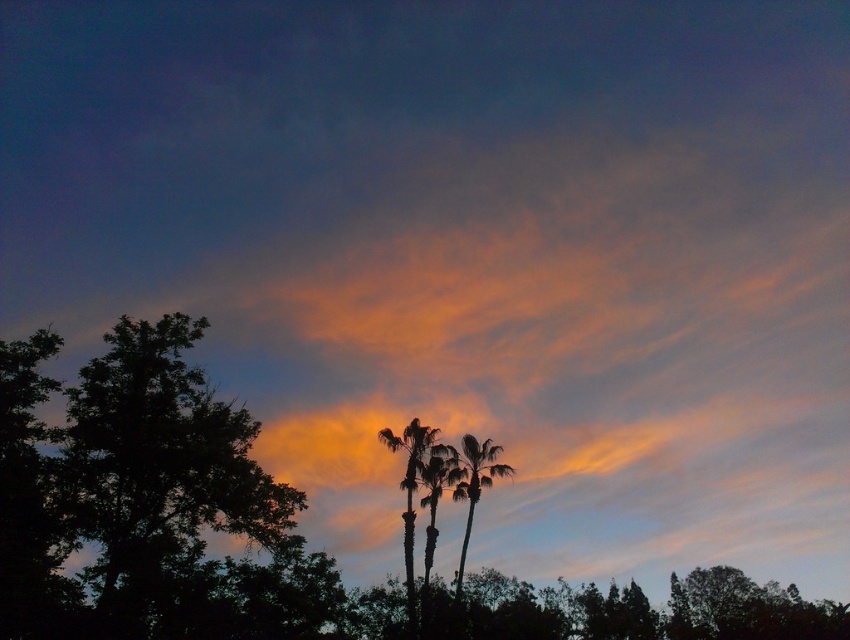
Question: Which point is farther from the camera taking this photo?

Choices:
 (A) (157, 557)
 (B) (422, 468)
 (C) (480, 472)

Answer: (C)

Question: Is silhouette palm trees at center below green leafy palm tree at center?

Choices:
 (A) yes
 (B) no

Answer: (B)

Question: Estimate the real-world distances between objects in this image. Which object is farther from the dark green leafy tree at left?

Choices:
 (A) silhouette palm trees at center
 (B) green leafy palm tree at center

Answer: (B)

Question: Is dark green leafy tree at left closer to camera compared to silhouette palm trees at center?

Choices:
 (A) yes
 (B) no

Answer: (A)

Question: Does silhouette palm trees at center have a greater width compared to green leafy palm tree at center?

Choices:
 (A) yes
 (B) no

Answer: (B)

Question: Which is farther from the green leafy palm tree at center?

Choices:
 (A) silhouette palm trees at center
 (B) silky green palm tree at center
 (C) dark green leafy tree at left

Answer: (C)